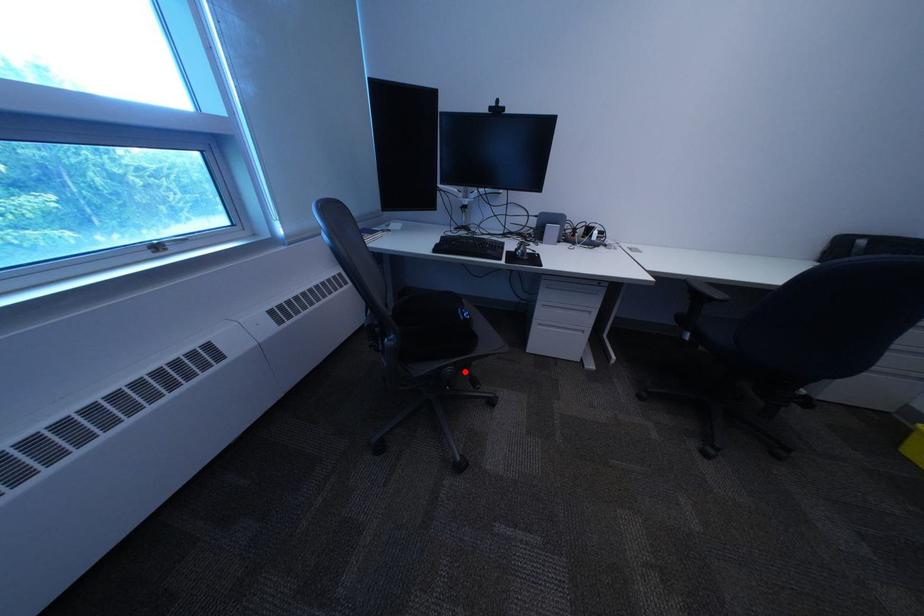
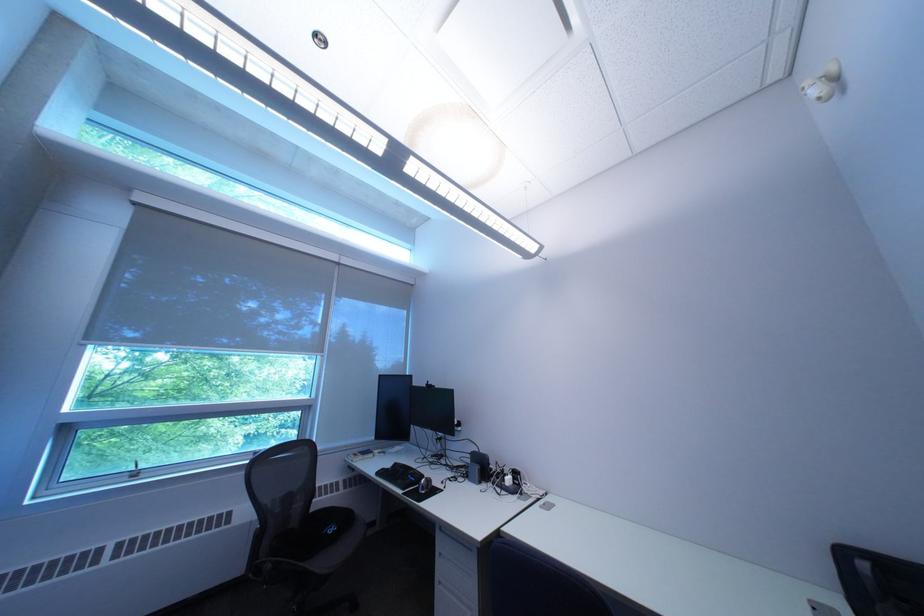
Locate, in the second image, the point that corresponds to the highlighted location in the first image.

(285, 568)